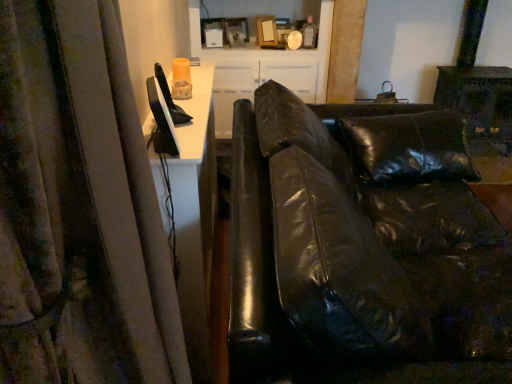
Question: Should I look upward or downward to see matte white cabinet at upper center?

Choices:
 (A) down
 (B) up

Answer: (B)

Question: From a real-world perspective, is black leather couch at center beneath matte white cabinet at upper center?

Choices:
 (A) no
 (B) yes

Answer: (B)

Question: Is black leather couch at center aimed at matte white cabinet at upper center?

Choices:
 (A) yes
 (B) no

Answer: (B)

Question: Does black leather couch at center have a lesser width compared to matte white cabinet at upper center?

Choices:
 (A) yes
 (B) no

Answer: (B)

Question: From the image's perspective, is black leather couch at center located beneath matte white cabinet at upper center?

Choices:
 (A) no
 (B) yes

Answer: (B)

Question: Is black leather couch at center surrounding matte white cabinet at upper center?

Choices:
 (A) no
 (B) yes

Answer: (A)

Question: Considering the relative sizes of black leather couch at center and matte white cabinet at upper center in the image provided, is black leather couch at center wider than matte white cabinet at upper center?

Choices:
 (A) yes
 (B) no

Answer: (A)

Question: Considering the relative positions of matte white cabinet at upper center and black leather couch at center in the image provided, is matte white cabinet at upper center to the left of black leather couch at center from the viewer's perspective?

Choices:
 (A) yes
 (B) no

Answer: (A)

Question: Is black leather couch at center completely or partially inside matte white cabinet at upper center?

Choices:
 (A) yes
 (B) no

Answer: (B)

Question: Does matte white cabinet at upper center turn towards black leather couch at center?

Choices:
 (A) no
 (B) yes

Answer: (B)

Question: From the image's perspective, is matte white cabinet at upper center located beneath black leather couch at center?

Choices:
 (A) yes
 (B) no

Answer: (B)

Question: Is matte white cabinet at upper center thinner than black leather couch at center?

Choices:
 (A) yes
 (B) no

Answer: (A)

Question: Is matte white cabinet at upper center bigger than black leather couch at center?

Choices:
 (A) no
 (B) yes

Answer: (A)

Question: From the image's perspective, relative to black leather couch at center, is matte white cabinet at upper center above or below?

Choices:
 (A) above
 (B) below

Answer: (A)